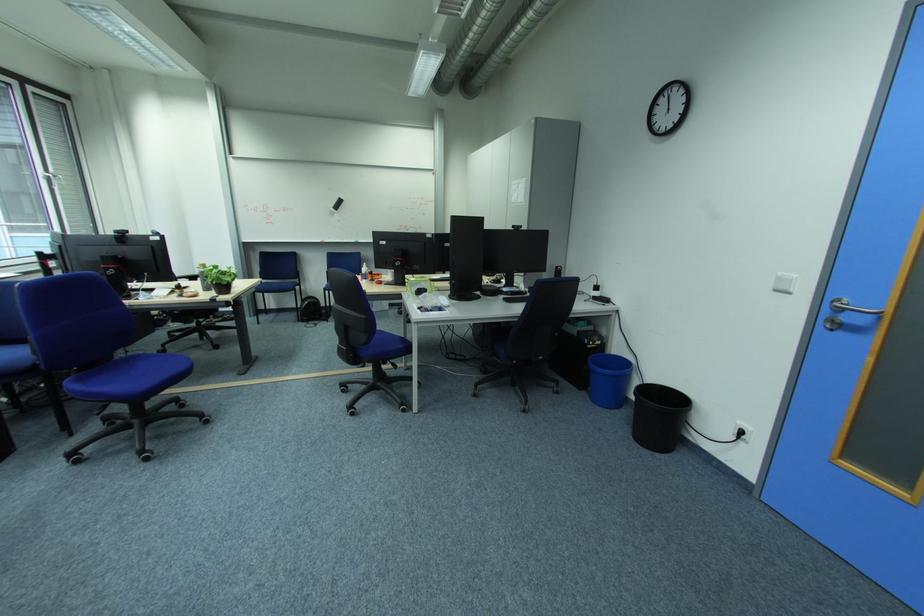
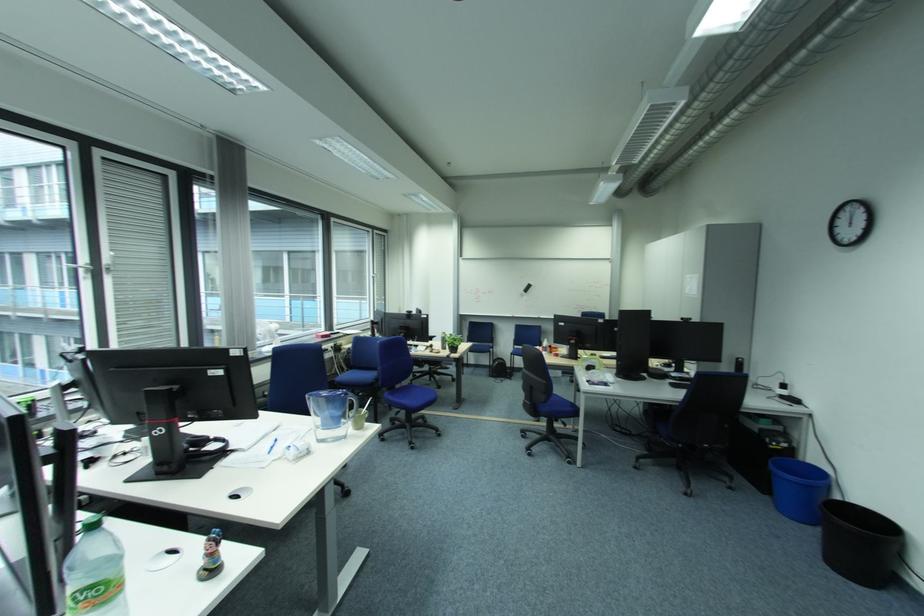
Question: Based on the continuous images, in which direction is the camera rotating? Reply with the corresponding letter.

Choices:
 (A) Left
 (B) Right
 (C) Up
 (D) Down

Answer: (A)